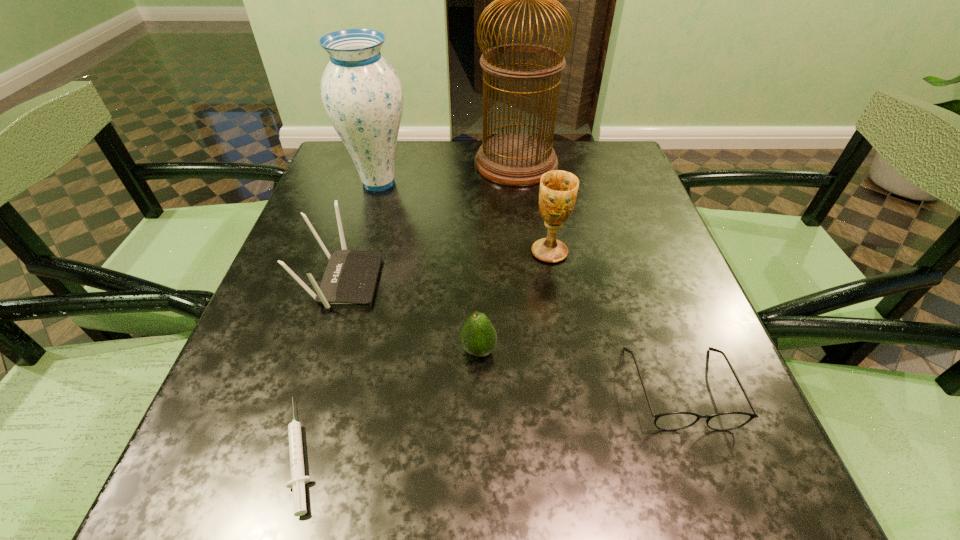
Locate an element on the screen. The height and width of the screenshot is (540, 960). vacant space that is in between the third shortest object and the third tallest object is located at coordinates (515, 301).

Select which object appears as the closest to the syringe. Please provide its 2D coordinates. Your answer should be formatted as a tuple, i.e. [(x, y)], where the tuple contains the x and y coordinates of a point satisfying the conditions above.

[(350, 277)]

Identify which object is the fourth nearest to the tallest object. Please provide its 2D coordinates. Your answer should be formatted as a tuple, i.e. [(x, y)], where the tuple contains the x and y coordinates of a point satisfying the conditions above.

[(478, 336)]

This screenshot has width=960, height=540. I want to click on vacant area in the image that satisfies the following two spatial constraints: 1. on the front side of the fifth shortest object; 2. on the front-facing side of the fourth tallest object, so click(x=555, y=281).

Image resolution: width=960 pixels, height=540 pixels. In order to click on blank area in the image that satisfies the following two spatial constraints: 1. on the back side of the syringe; 2. on the front-facing side of the router in this screenshot , I will do `click(350, 281)`.

Where is `free region that satisfies the following two spatial constraints: 1. on the front-facing side of the fifth shortest object; 2. on the left side of the birdcage`? free region that satisfies the following two spatial constraints: 1. on the front-facing side of the fifth shortest object; 2. on the left side of the birdcage is located at coordinates (526, 252).

At what (x,y) coordinates should I click in order to perform the action: click on free point that satisfies the following two spatial constraints: 1. on the front-facing side of the fourth tallest object; 2. on the left side of the fifth tallest object. Please return your answer as a coordinate pair (x, y). Looking at the image, I should click on (322, 350).

This screenshot has height=540, width=960. In order to click on free location that satisfies the following two spatial constraints: 1. on the front-facing side of the third tallest object; 2. on the left side of the tallest object in this screenshot , I will do `click(526, 252)`.